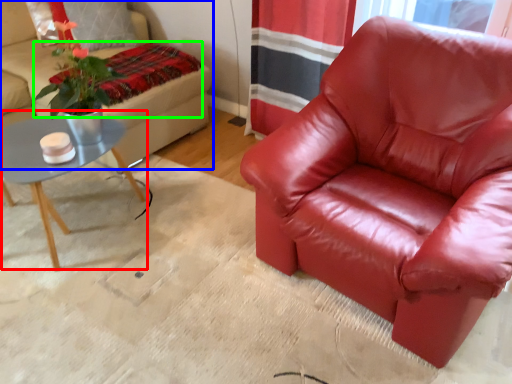
Question: Considering the real-world distances, which object is closest to coffee table (highlighted by a red box)? studio couch (highlighted by a blue box) or blanket (highlighted by a green box).

Choices:
 (A) studio couch
 (B) blanket

Answer: (A)